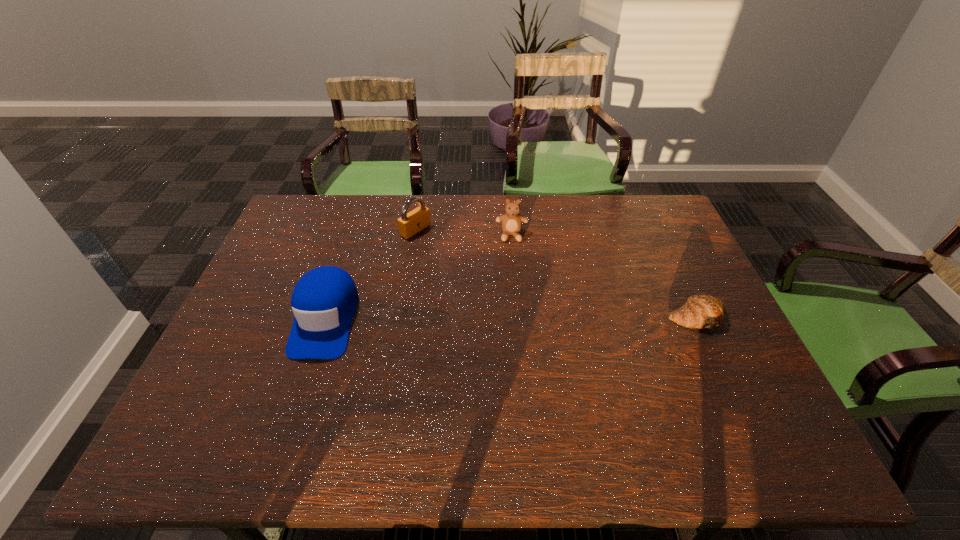
Locate an element on the screen. the leftmost object is located at coordinates point(324,301).

At what (x,y) coordinates should I click in order to perform the action: click on the rightmost object. Please return your answer as a coordinate pair (x, y). This screenshot has width=960, height=540. Looking at the image, I should click on (704, 311).

Locate an element on the screen. This screenshot has height=540, width=960. crescent roll is located at coordinates (704, 311).

At what (x,y) coordinates should I click in order to perform the action: click on the second object from left to right. Please return your answer as a coordinate pair (x, y). Looking at the image, I should click on (411, 223).

The image size is (960, 540). In order to click on teddy bear in this screenshot , I will do `click(512, 221)`.

Identify the location of vacant space located on the front of the crescent roll. The width and height of the screenshot is (960, 540). (718, 364).

Where is `free point located to unlock the padlock from the front`? This screenshot has width=960, height=540. free point located to unlock the padlock from the front is located at coordinates (479, 268).

Where is `free location located 0.120m to unlock the padlock from the front`? free location located 0.120m to unlock the padlock from the front is located at coordinates (452, 253).

This screenshot has height=540, width=960. In order to click on free space located to unlock the padlock from the front in this screenshot , I will do `click(476, 267)`.

Locate an element on the screen. free region located 0.340m on the front-facing side of the second object from right to left is located at coordinates (514, 326).